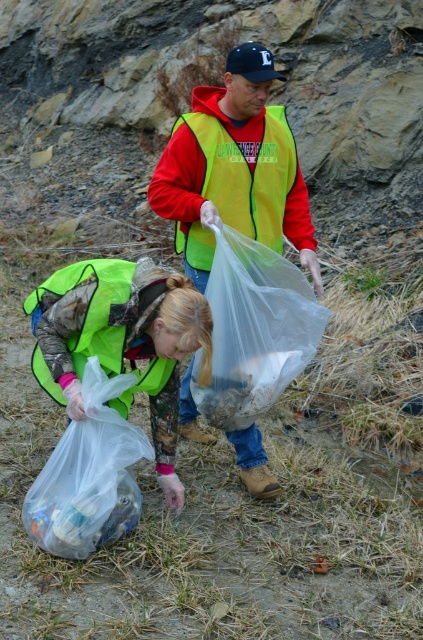
Question: Which is nearer to the matte green vest at lower left?

Choices:
 (A) translucent plastic bag at lower left
 (B) transparent plastic bag at center
 (C) matte red jacket at center

Answer: (A)

Question: Does matte green vest at lower left appear on the left side of translucent plastic bag at lower left?

Choices:
 (A) no
 (B) yes

Answer: (A)

Question: Does matte yellow vest at center have a larger size compared to matte red jacket at center?

Choices:
 (A) yes
 (B) no

Answer: (A)

Question: Which point is closer to the camera taking this photo?

Choices:
 (A) (296, 220)
 (B) (241, 122)

Answer: (B)

Question: Which of these objects is positioned closest to the transparent plastic bag at center?

Choices:
 (A) translucent plastic bag at lower left
 (B) matte green vest at lower left
 (C) matte yellow vest at center
 (D) matte red jacket at center

Answer: (B)

Question: Can you confirm if matte yellow vest at center is positioned below transparent plastic bag at center?

Choices:
 (A) no
 (B) yes

Answer: (A)